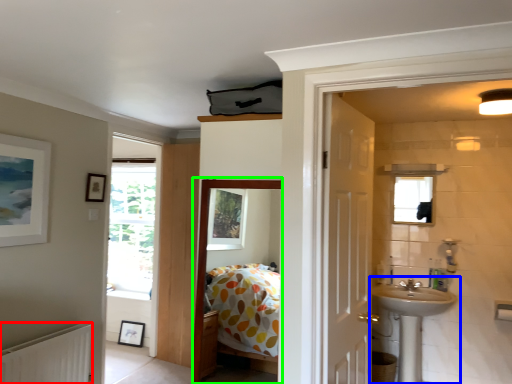
Question: Which object is positioned closest to radiator (highlighted by a red box)? Select from sink (highlighted by a blue box) and corridor (highlighted by a green box).

Choices:
 (A) sink
 (B) corridor

Answer: (B)